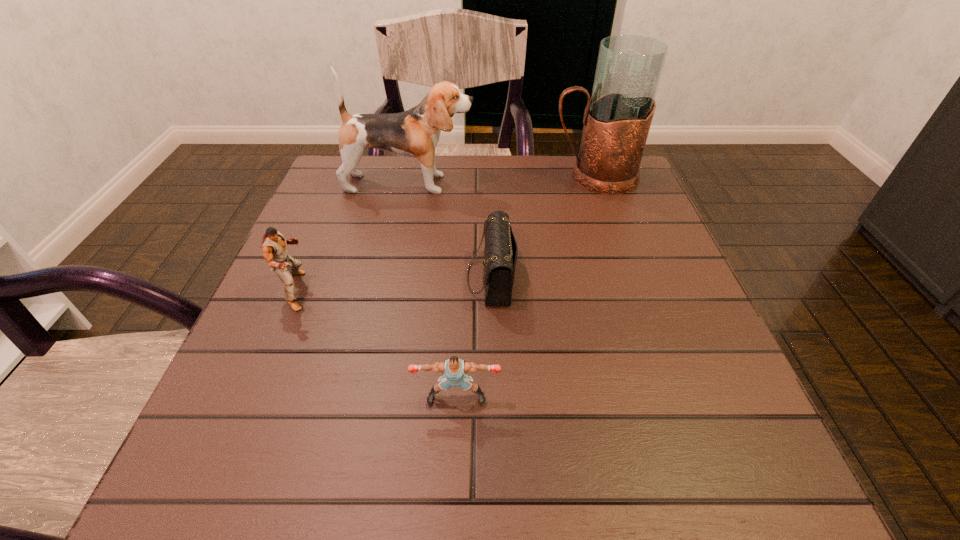
Where is `free space between the farther puncher and the clutch bag`? free space between the farther puncher and the clutch bag is located at coordinates (394, 284).

At what (x,y) coordinates should I click in order to perform the action: click on free point between the shorter puncher and the taller puncher. Please return your answer as a coordinate pair (x, y). The image size is (960, 540). Looking at the image, I should click on (376, 344).

The height and width of the screenshot is (540, 960). In order to click on vacant area between the puppy and the rightmost object in this screenshot , I will do `click(502, 180)`.

This screenshot has height=540, width=960. I want to click on empty space between the pitcher and the nearest object, so [x=525, y=287].

Identify the location of unoccupied position between the clutch bag and the nearer puncher. [x=473, y=338].

You are a GUI agent. You are given a task and a screenshot of the screen. Output one action in this format:
    pyautogui.click(x=<x>, y=<y>)
    Task: Click on the vacant region between the farther puncher and the puppy
    
    Given the screenshot: What is the action you would take?
    pyautogui.click(x=352, y=237)

Locate an element on the screen. vacant area that lies between the third shortest object and the clutch bag is located at coordinates (394, 284).

Locate which object ranks second in proximity to the rightmost object. Please provide its 2D coordinates. Your answer should be formatted as a tuple, i.e. [(x, y)], where the tuple contains the x and y coordinates of a point satisfying the conditions above.

[(500, 253)]

Identify which object is the third closest to the clutch bag. Please provide its 2D coordinates. Your answer should be formatted as a tuple, i.e. [(x, y)], where the tuple contains the x and y coordinates of a point satisfying the conditions above.

[(617, 119)]

You are a GUI agent. You are given a task and a screenshot of the screen. Output one action in this format:
    pyautogui.click(x=<x>, y=<y>)
    Task: Click on the blank space that satisfies the following two spatial constraints: 1. on the front flap of the clutch bag; 2. on the front-facing side of the shorter puncher
    
    Given the screenshot: What is the action you would take?
    pyautogui.click(x=494, y=398)